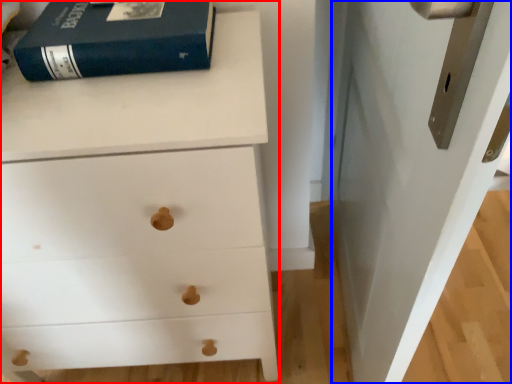
Question: Among these objects, which one is farthest to the camera, chest of drawers (highlighted by a red box) or door (highlighted by a blue box)?

Choices:
 (A) chest of drawers
 (B) door

Answer: (A)